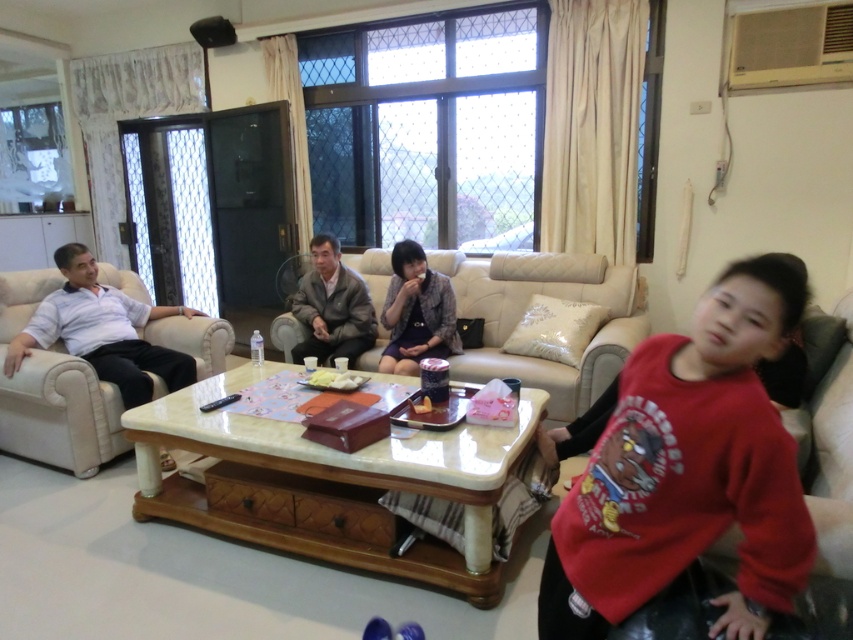
You are sitting on the beige quilted couch at center and want to hand a book to the person wearing the red cotton shirt at right. In which direction should you move to reach them?

The red cotton shirt at right is to the left of the beige quilted couch at center, so you should move to your left to reach them.

You are a guest at this gathering and want to sit next to the person wearing the patterned fabric dress at center. Which direction should you move from the beige leather couch at left to get closer to them?

The beige leather couch at left is to the left of the patterned fabric dress at center. To sit next to the patterned fabric dress at center, you should move to the right from the beige leather couch at left.

You are standing at the camera position and want to pick up the patterned fabric dress at center. Is it within your reach?

The patterned fabric dress at center is 3.48 meters from the camera, so it is too far to reach from the camera position.